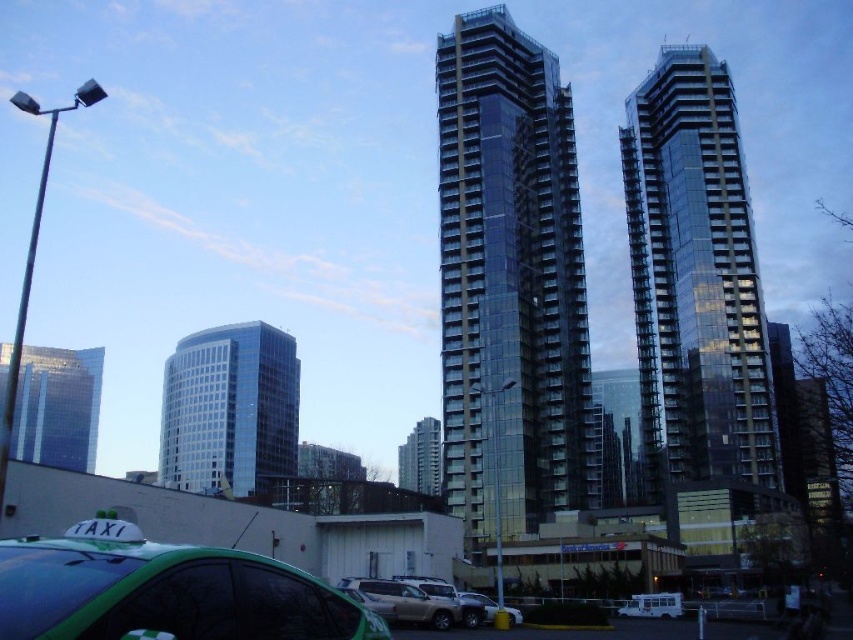
Between green matte taxi at lower left and blue glass building at center, which one is positioned lower?

Result: blue glass building at center

Between point (165, 548) and point (196, 332), which one is positioned behind?

The point (196, 332) is behind.

Where is `green matte taxi at lower left`? The width and height of the screenshot is (853, 640). green matte taxi at lower left is located at coordinates (163, 589).

Between glassy reflective skyscraper at left and matte silver suv at center, which one appears on the right side from the viewer's perspective?

From the viewer's perspective, matte silver suv at center appears more on the right side.

Which is behind, point (4, 396) or point (412, 602)?

Point (4, 396)

What do you see at coordinates (57, 406) in the screenshot? I see `glassy reflective skyscraper at left` at bounding box center [57, 406].

Locate an element on the screen. This screenshot has height=640, width=853. glassy reflective skyscraper at left is located at coordinates (57, 406).

Which is more to the right, glassy steel skyscraper at center or transparent glass building at center?

Positioned to the right is transparent glass building at center.

Does glassy steel skyscraper at center have a lesser width compared to transparent glass building at center?

In fact, glassy steel skyscraper at center might be wider than transparent glass building at center.

Measure the distance between glassy steel skyscraper at center and camera.

The distance of glassy steel skyscraper at center from camera is 245.73 feet.

Image resolution: width=853 pixels, height=640 pixels. Identify the location of glassy steel skyscraper at center. (509, 280).